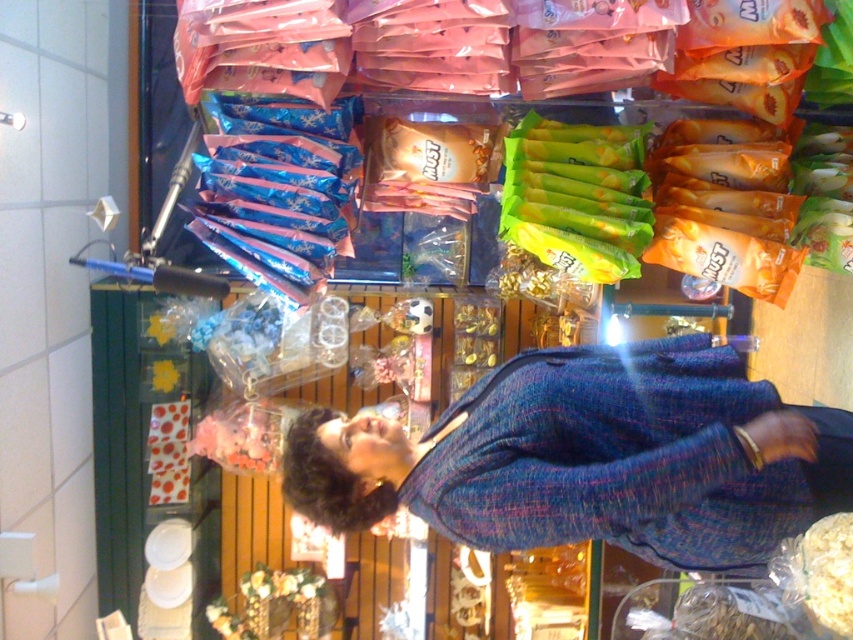
You are a store employee who needs to determine if the blue tweed jacket at center can be placed in a storage box designed for items smaller than the green matte candy at center. Can it fit?

The blue tweed jacket at center is bigger than the green matte candy at center, so it cannot fit in the storage box designed for items smaller than the green matte candy at center.